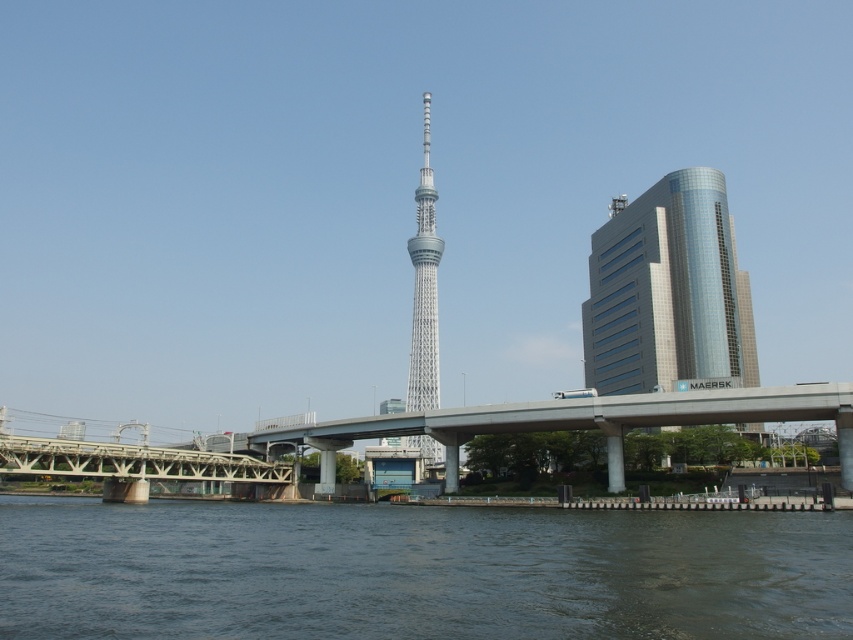
Is concrete bridge at lower left above silver metallic tv tower at center?

Actually, concrete bridge at lower left is below silver metallic tv tower at center.

Does concrete bridge at lower left lie behind silver metallic tv tower at center?

No, concrete bridge at lower left is in front of silver metallic tv tower at center.

This screenshot has height=640, width=853. I want to click on concrete bridge at lower left, so click(144, 467).

The width and height of the screenshot is (853, 640). I want to click on concrete bridge at lower left, so click(x=144, y=467).

Consider the image. Does dark gray water at lower center have a greater height compared to glassy silver skyscraper at right?

In fact, dark gray water at lower center may be shorter than glassy silver skyscraper at right.

Who is more distant from viewer, (180, 566) or (700, 376)?

Point (700, 376)

Where is `dark gray water at lower center`? The width and height of the screenshot is (853, 640). dark gray water at lower center is located at coordinates (416, 572).

Who is more forward, (735, 298) or (258, 445)?

Point (258, 445) is more forward.

Is glassy silver skyscraper at right taller than concrete bridge at center?

Yes.

Image resolution: width=853 pixels, height=640 pixels. Describe the element at coordinates (668, 292) in the screenshot. I see `glassy silver skyscraper at right` at that location.

This screenshot has width=853, height=640. Find the location of `glassy silver skyscraper at right`. glassy silver skyscraper at right is located at coordinates (668, 292).